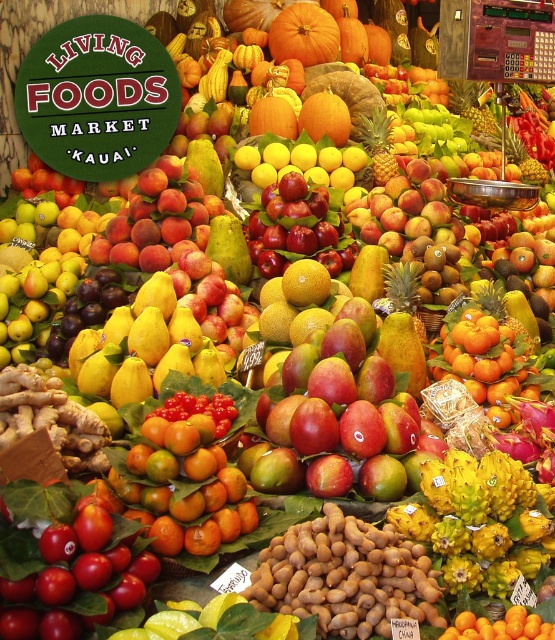
You are a customer at the Living Foods Market in Kauai, and you want to buy both the shiny orange tangerines at center and the shiny red apples at center. If you need to reach both items with your arms stretched out, can you do so without moving your feet? Assume your arm span is 1.8 meters.

The shiny orange tangerines at center and shiny red apples at center are 1.93 meters apart. Since your arm span is 1.8 meters, which is shorter than the distance between them, you cannot reach both items without moving your feet.

You are a customer at the Living Foods Market in Kauai, looking at the vibrant fruit display. You see the shiny orange tangerines at center and the shiny red apple at center. Which fruit is positioned lower in the arrangement?

The shiny orange tangerines at center are positioned lower than the shiny red apple at center because they are shorter in height.

You are a customer at the Living Foods Market in Kauai, and you see a point marked at coordinates (184, 484). What fruit is located at this point?

The shiny orange tangerines at center is located at point (184, 484).